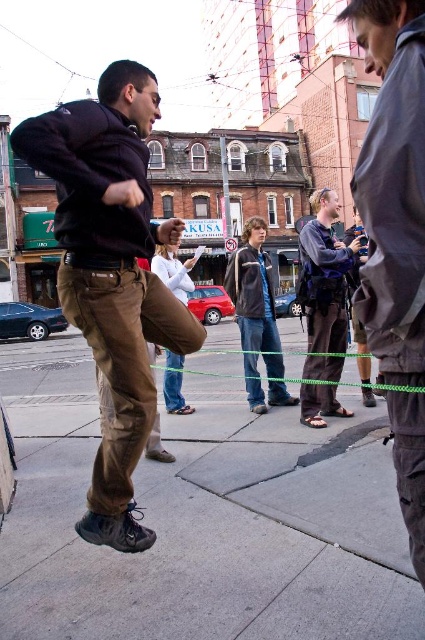
Question: Among these objects, which one is farthest from the camera?

Choices:
 (A) gray fabric jacket at right
 (B) brown leather pants at center

Answer: (B)

Question: Does matte brown pants at center appear under gray fabric jacket at right?

Choices:
 (A) no
 (B) yes

Answer: (B)

Question: Among these objects, which one is nearest to the camera?

Choices:
 (A) dark gray fleece jacket at center
 (B) gray fabric jacket at right
 (C) gray concrete sidewalk at center

Answer: (C)

Question: Does brown leather pants at center appear on the left side of dark gray fleece jacket at center?

Choices:
 (A) no
 (B) yes

Answer: (A)

Question: Is the position of matte brown pants at center less distant than that of dark gray fleece jacket at center?

Choices:
 (A) yes
 (B) no

Answer: (A)

Question: Estimate the real-world distances between objects in this image. Which object is farther from the matte brown pants at center?

Choices:
 (A) dark gray fleece jacket at center
 (B) gray concrete sidewalk at center

Answer: (A)